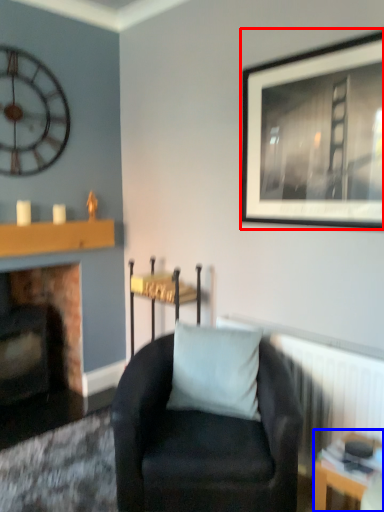
Question: Which of the following is the farthest to the observer, picture frame (highlighted by a red box) or table (highlighted by a blue box)?

Choices:
 (A) picture frame
 (B) table

Answer: (A)